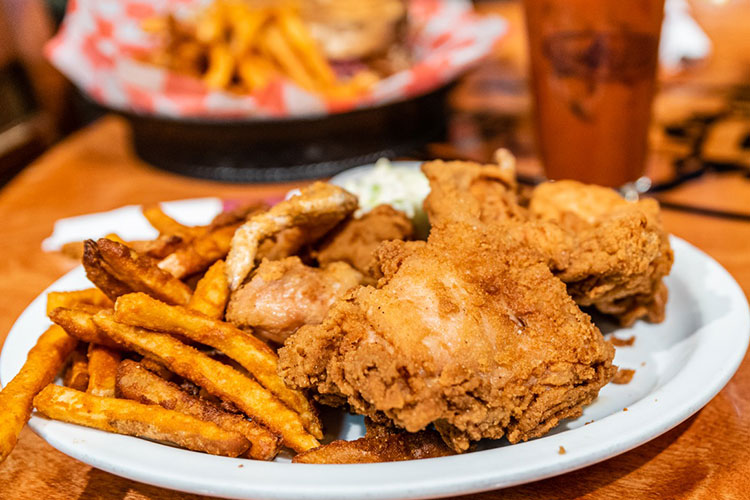
What are the coordinates of `2 plates` in the screenshot? It's located at (183, 252), (286, 41).